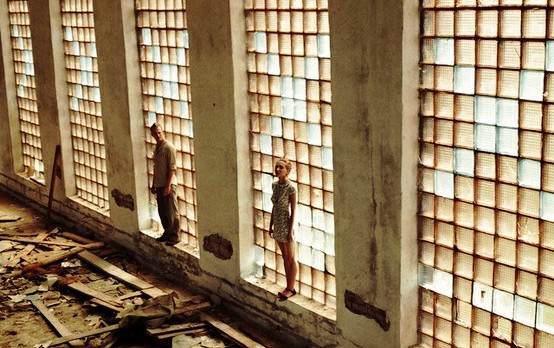
Locate an element on the screen. The image size is (554, 348). floor is located at coordinates coord(25,327).